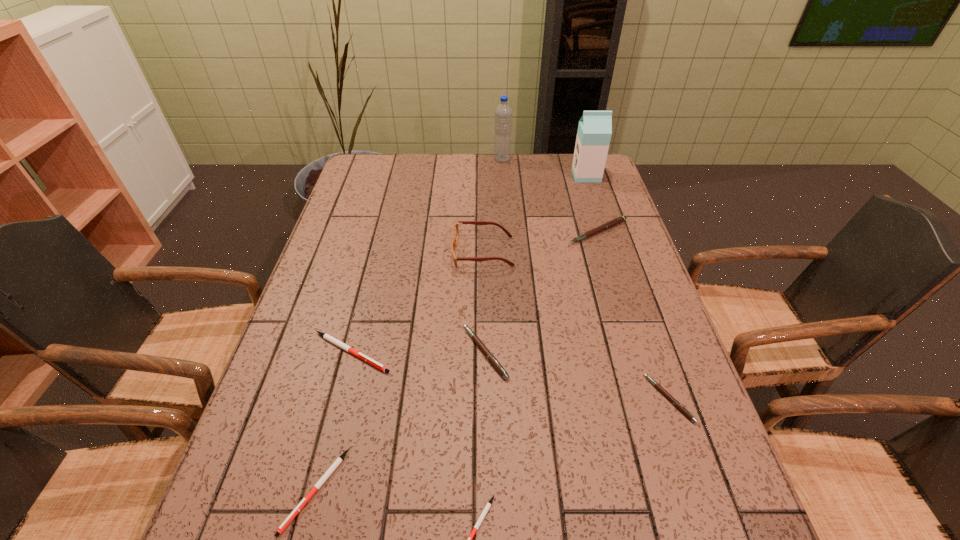
Locate an element on the screen. The width and height of the screenshot is (960, 540). free space between the spectacles and the smallest pink pen is located at coordinates (576, 325).

Identify the location of free area in between the farthest white pen and the farthest object. This screenshot has height=540, width=960. (426, 255).

Locate an element on the screen. The height and width of the screenshot is (540, 960). empty space that is in between the smallest pink pen and the second farthest object is located at coordinates (628, 287).

Identify which object is the third closest to the biggest pink pen. Please provide its 2D coordinates. Your answer should be formatted as a tuple, i.e. [(x, y)], where the tuple contains the x and y coordinates of a point satisfying the conditions above.

[(480, 344)]

Identify which object is the sixth closest to the biggest white pen. Please provide its 2D coordinates. Your answer should be formatted as a tuple, i.e. [(x, y)], where the tuple contains the x and y coordinates of a point satisfying the conditions above.

[(609, 224)]

This screenshot has width=960, height=540. What are the coordinates of `the third closest pen relative to the biggest white pen` in the screenshot? It's located at (488, 505).

Identify which pen is the fifth closest to the fourth tallest object. Please provide its 2D coordinates. Your answer should be formatted as a tuple, i.e. [(x, y)], where the tuple contains the x and y coordinates of a point satisfying the conditions above.

[(288, 520)]

This screenshot has width=960, height=540. I want to click on pink pen object that ranks as the second closest to the smallest pink pen, so click(609, 224).

Where is `pink pen that is the second closest to the smallest pink pen`? The width and height of the screenshot is (960, 540). pink pen that is the second closest to the smallest pink pen is located at coordinates (609, 224).

Select which white pen appears as the second closest to the second biggest white pen. Please provide its 2D coordinates. Your answer should be formatted as a tuple, i.e. [(x, y)], where the tuple contains the x and y coordinates of a point satisfying the conditions above.

[(488, 505)]